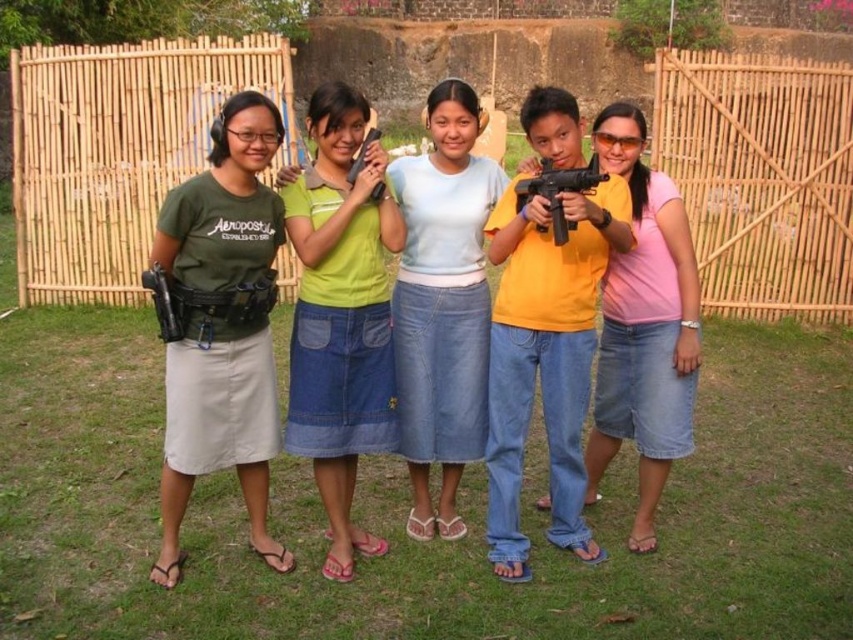
Based on the scene description, can you determine which object is taller between the pink matte shirt at center and the matte black gun at center?

The pink matte shirt at center is not as tall as matte black gun at center, so the matte black gun at center is taller.

You are a photographer trying to capture a group photo of the pink matte shirt at center and the matte black gun at center. If you want to ensure both are fully visible in the frame, which object should you focus on first to avoid cropping either?

The pink matte shirt at center might be wider than matte black gun at center, so you should focus on the pink matte shirt at center first to ensure it fits within the frame without cropping.